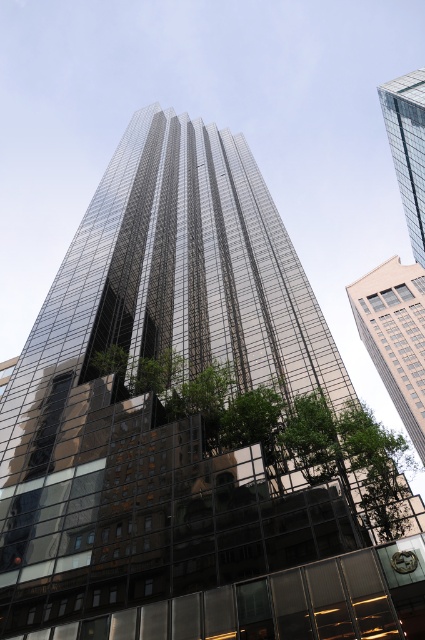
Who is more distant from viewer, (223, 372) or (405, 282)?

The point (405, 282) is behind.

Is green leafy tree at center above beige glass building at right?

Yes, green leafy tree at center is above beige glass building at right.

Does point (371, 513) come closer to viewer compared to point (382, 298)?

Yes, point (371, 513) is closer to viewer.

You are a GUI agent. You are given a task and a screenshot of the screen. Output one action in this format:
    pyautogui.click(x=<x>, y=<y>)
    Task: Click on the green leafy tree at center
    This screenshot has width=425, height=640.
    Given the screenshot: What is the action you would take?
    277,432

Is green leafy tree at center below glassy reflective skyscraper at upper right?

Yes.

Is green leafy tree at center positioned behind glassy reflective skyscraper at upper right?

No.

Who is more forward, [356,502] or [416,97]?

Point [356,502] is in front.

This screenshot has height=640, width=425. I want to click on green leafy tree at center, so click(277, 432).

Does beige glass building at right come behind glassy reflective skyscraper at upper right?

Yes.

Which is behind, point (402, 317) or point (411, 145)?

The point (402, 317) is more distant.

Locate an element on the screen. This screenshot has height=640, width=425. beige glass building at right is located at coordinates (394, 337).